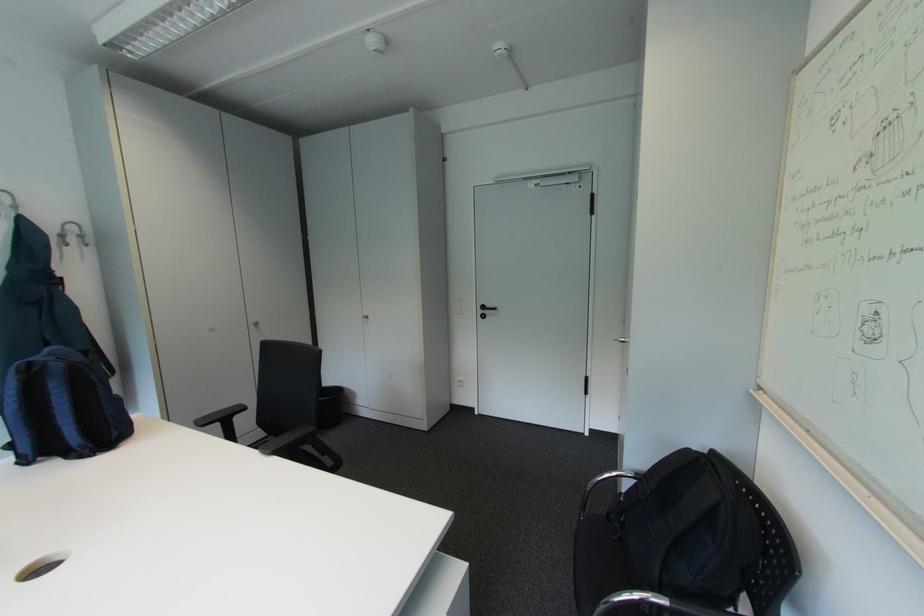
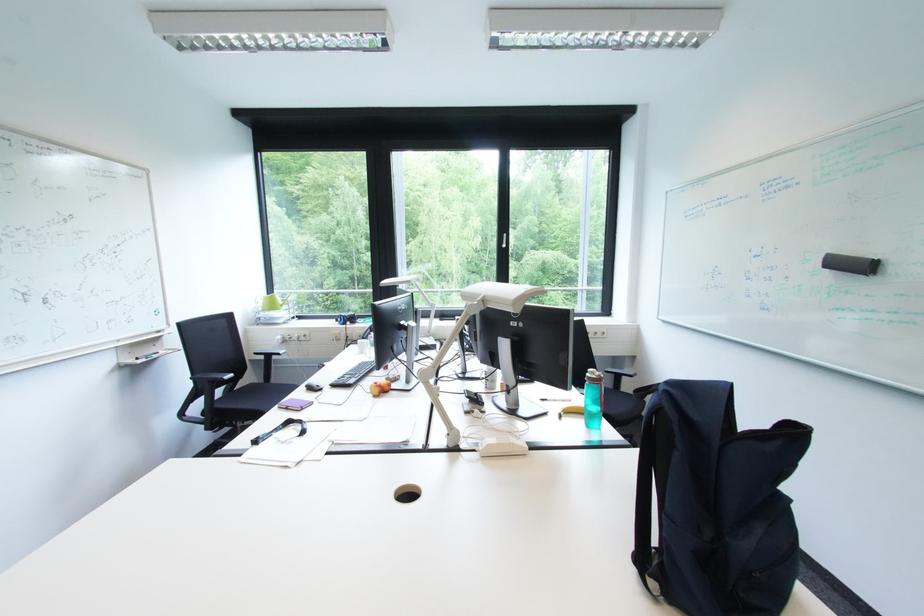
Find the pixel in the second image that matches (50,572) in the first image.

(418, 496)